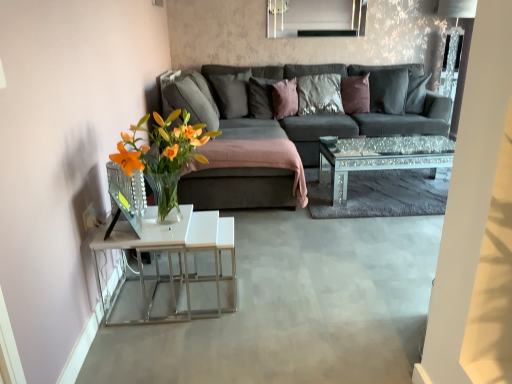
The width and height of the screenshot is (512, 384). What do you see at coordinates (381, 158) in the screenshot?
I see `sparkly glass coffee table at center` at bounding box center [381, 158].

Find the location of a particular element. The image size is (512, 384). purple velvet pillow at center, which is counted as the third pillow, starting from the right is located at coordinates (285, 98).

At what (x,y) coordinates should I click in order to perform the action: click on dark gray fabric pillow at center, which is counted as the 1th pillow, starting from the right. Please return your answer as a coordinate pair (x, y). The image size is (512, 384). Looking at the image, I should click on (385, 88).

The height and width of the screenshot is (384, 512). In order to click on matte gray pillow at center, the fifth pillow from the right in this screenshot , I will do `click(230, 95)`.

Considering the relative sizes of dark gray fabric pillow at center, which appears as the 5th pillow when viewed from the left, and velvet brown pillow at center, the second pillow when ordered from right to left, in the image provided, is dark gray fabric pillow at center, which appears as the 5th pillow when viewed from the left, bigger than velvet brown pillow at center, the second pillow when ordered from right to left,?

Yes, dark gray fabric pillow at center, which appears as the 5th pillow when viewed from the left, is bigger than velvet brown pillow at center, the second pillow when ordered from right to left.

Is velvet brown pillow at center, the second pillow when ordered from right to left, completely or partially inside dark gray fabric pillow at center, which is counted as the 1th pillow, starting from the right?

Yes, velvet brown pillow at center, the second pillow when ordered from right to left, is inside dark gray fabric pillow at center, which is counted as the 1th pillow, starting from the right.

Considering the relative positions of dark gray fabric pillow at center, which appears as the 5th pillow when viewed from the left, and velvet brown pillow at center, which is the 4th pillow in left-to-right order, in the image provided, is dark gray fabric pillow at center, which appears as the 5th pillow when viewed from the left, to the left of velvet brown pillow at center, which is the 4th pillow in left-to-right order, from the viewer's perspective?

Incorrect, dark gray fabric pillow at center, which appears as the 5th pillow when viewed from the left, is not on the left side of velvet brown pillow at center, which is the 4th pillow in left-to-right order.

Starting from the dark gray fabric pillow at center, which appears as the 5th pillow when viewed from the left, which pillow is the 3rd one behind? Please provide its 2D coordinates.

[(355, 94)]

Is purple velvet pillow at center, which is the third pillow from left to right, positioned with its back to matte gray pillow at center, acting as the first pillow starting from the left?

Yes, purple velvet pillow at center, which is the third pillow from left to right,'s orientation is away from matte gray pillow at center, acting as the first pillow starting from the left.

In terms of size, does purple velvet pillow at center, which is the third pillow from left to right, appear bigger or smaller than matte gray pillow at center, the fifth pillow from the right?

In the image, purple velvet pillow at center, which is the third pillow from left to right, appears to be smaller than matte gray pillow at center, the fifth pillow from the right.

Between purple velvet pillow at center, which is counted as the third pillow, starting from the right, and matte gray pillow at center, acting as the first pillow starting from the left, which one appears on the left side from the viewer's perspective?

matte gray pillow at center, acting as the first pillow starting from the left, is more to the left.

From the image's perspective, which object appears higher, purple velvet pillow at center, which is counted as the third pillow, starting from the right, or matte gray pillow at center, the fifth pillow from the right?

matte gray pillow at center, the fifth pillow from the right, appears higher in the image.

Is velvet brown pillow at center, which is the 4th pillow in left-to-right order, directly adjacent to matte gray pillow at center, acting as the first pillow starting from the left?

No, velvet brown pillow at center, which is the 4th pillow in left-to-right order, is not touching matte gray pillow at center, acting as the first pillow starting from the left.

Could matte gray pillow at center, the fifth pillow from the right, be considered to be inside velvet brown pillow at center, the second pillow when ordered from right to left?

Actually, matte gray pillow at center, the fifth pillow from the right, is outside velvet brown pillow at center, the second pillow when ordered from right to left.

Does velvet brown pillow at center, which is the 4th pillow in left-to-right order, have a greater width compared to matte gray pillow at center, acting as the first pillow starting from the left?

Incorrect, the width of velvet brown pillow at center, which is the 4th pillow in left-to-right order, does not surpass that of matte gray pillow at center, acting as the first pillow starting from the left.

Does point (356, 105) come farther from viewer compared to point (224, 86)?

Yes, it is behind point (224, 86).

Who is smaller, satin brown pillow at center, marked as the second pillow in a left-to-right arrangement, or purple velvet pillow at center, which is the third pillow from left to right?

purple velvet pillow at center, which is the third pillow from left to right, is smaller.

Is satin brown pillow at center, the fourth pillow positioned from the right, shorter than purple velvet pillow at center, which is counted as the third pillow, starting from the right?

No.

From the picture: What's the angular difference between satin brown pillow at center, the fourth pillow positioned from the right, and purple velvet pillow at center, which is counted as the third pillow, starting from the right,'s facing directions?

17.8 degrees separate the facing orientations of satin brown pillow at center, the fourth pillow positioned from the right, and purple velvet pillow at center, which is counted as the third pillow, starting from the right.

From the image's perspective, is satin brown pillow at center, the fourth pillow positioned from the right, located above or below dark gray fabric couch at center?

satin brown pillow at center, the fourth pillow positioned from the right, is situated higher than dark gray fabric couch at center in the image.

Does satin brown pillow at center, marked as the second pillow in a left-to-right arrangement, touch dark gray fabric couch at center?

No, satin brown pillow at center, marked as the second pillow in a left-to-right arrangement, is not with dark gray fabric couch at center.

Does satin brown pillow at center, marked as the second pillow in a left-to-right arrangement, turn towards dark gray fabric couch at center?

Yes, satin brown pillow at center, marked as the second pillow in a left-to-right arrangement, is oriented towards dark gray fabric couch at center.

Which is closer, (x=253, y=91) or (x=337, y=137)?

Point (x=253, y=91) appears to be farther away from the viewer than point (x=337, y=137).

Which is closer, (438,133) or (289,102)?

The point (438,133) is closer to the camera.

Considering the positions of objects dark gray fabric couch at center and purple velvet pillow at center, which is the third pillow from left to right, in the image provided, who is in front, dark gray fabric couch at center or purple velvet pillow at center, which is the third pillow from left to right,?

dark gray fabric couch at center is in front.

In terms of height, does dark gray fabric couch at center look taller or shorter compared to purple velvet pillow at center, which is the third pillow from left to right?

In the image, dark gray fabric couch at center appears to be taller than purple velvet pillow at center, which is the third pillow from left to right.

Is matte gray pillow at center, acting as the first pillow starting from the left, with dark gray fabric couch at center?

No, matte gray pillow at center, acting as the first pillow starting from the left, is not with dark gray fabric couch at center.

Is matte gray pillow at center, acting as the first pillow starting from the left, oriented towards dark gray fabric couch at center?

Yes, matte gray pillow at center, acting as the first pillow starting from the left, is facing dark gray fabric couch at center.

There is a dark gray fabric couch at center. Identify the location of the 4th pillow above it (from a real-world perspective). The image size is (512, 384). (230, 95).

From the image's perspective, which one is positioned lower, matte gray pillow at center, acting as the first pillow starting from the left, or dark gray fabric couch at center?

dark gray fabric couch at center, from the image's perspective.

The width and height of the screenshot is (512, 384). In order to click on the 3rd pillow in front of the velvet brown pillow at center, which is the 4th pillow in left-to-right order in this screenshot , I will do `click(385, 88)`.

From a real-world perspective, which pillow is the 3rd one above the purple velvet pillow at center, which is counted as the third pillow, starting from the right? Please provide its 2D coordinates.

[(230, 95)]

Consider the image. Estimate the real-world distances between objects in this image. Which object is further from sparkly glass coffee table at center, dark gray fabric pillow at center, which is counted as the 1th pillow, starting from the right, or matte gray pillow at center, the fifth pillow from the right?

Based on the image, matte gray pillow at center, the fifth pillow from the right, appears to be further to sparkly glass coffee table at center.

When comparing their distances from satin brown pillow at center, the fourth pillow positioned from the right, does matte gray pillow at center, the fifth pillow from the right, or sparkly glass coffee table at center seem closer?

matte gray pillow at center, the fifth pillow from the right.

When comparing their distances from dark gray fabric couch at center, does matte gray pillow at center, acting as the first pillow starting from the left, or purple velvet pillow at center, which is counted as the third pillow, starting from the right, seem further?

matte gray pillow at center, acting as the first pillow starting from the left, lies further to dark gray fabric couch at center than the other object.

Based on the photo, which object lies further to the anchor point dark gray fabric pillow at center, which is counted as the 1th pillow, starting from the right, satin brown pillow at center, marked as the second pillow in a left-to-right arrangement, or dark gray fabric couch at center?

satin brown pillow at center, marked as the second pillow in a left-to-right arrangement, is positioned further to the anchor dark gray fabric pillow at center, which is counted as the 1th pillow, starting from the right.

When comparing their distances from dark gray fabric couch at center, does sparkly glass coffee table at center or dark gray fabric pillow at center, which appears as the 5th pillow when viewed from the left, seem closer?

sparkly glass coffee table at center.

Which object lies nearer to the anchor point dark gray fabric pillow at center, which appears as the 5th pillow when viewed from the left, velvet brown pillow at center, which is the 4th pillow in left-to-right order, or sparkly glass coffee table at center?

Based on the image, velvet brown pillow at center, which is the 4th pillow in left-to-right order, appears to be nearer to dark gray fabric pillow at center, which appears as the 5th pillow when viewed from the left.

From the image, which object appears to be nearer to dark gray fabric pillow at center, which is counted as the 1th pillow, starting from the right, satin brown pillow at center, the fourth pillow positioned from the right, or purple velvet pillow at center, which is counted as the third pillow, starting from the right?

Among the two, purple velvet pillow at center, which is counted as the third pillow, starting from the right, is located nearer to dark gray fabric pillow at center, which is counted as the 1th pillow, starting from the right.

Which object lies further to the anchor point sparkly glass coffee table at center, velvet brown pillow at center, which is the 4th pillow in left-to-right order, or dark gray fabric pillow at center, which is counted as the 1th pillow, starting from the right?

Among the two, velvet brown pillow at center, which is the 4th pillow in left-to-right order, is located further to sparkly glass coffee table at center.

Where is `pillow between dark gray fabric couch at center and dark gray fabric pillow at center, which appears as the 5th pillow when viewed from the left, along the z-axis`? The image size is (512, 384). pillow between dark gray fabric couch at center and dark gray fabric pillow at center, which appears as the 5th pillow when viewed from the left, along the z-axis is located at coordinates (230, 95).

Identify the location of pillow between matte gray pillow at center, acting as the first pillow starting from the left, and purple velvet pillow at center, which is counted as the third pillow, starting from the right, in the horizontal direction. Image resolution: width=512 pixels, height=384 pixels. (261, 97).

Identify the location of coffee table located between dark gray fabric couch at center and velvet brown pillow at center, the second pillow when ordered from right to left, in the depth direction. Image resolution: width=512 pixels, height=384 pixels. (381, 158).

At what (x,y) coordinates should I click in order to perform the action: click on coffee table between dark gray fabric couch at center and purple velvet pillow at center, which is the third pillow from left to right, along the z-axis. Please return your answer as a coordinate pair (x, y). This screenshot has height=384, width=512. Looking at the image, I should click on (381, 158).